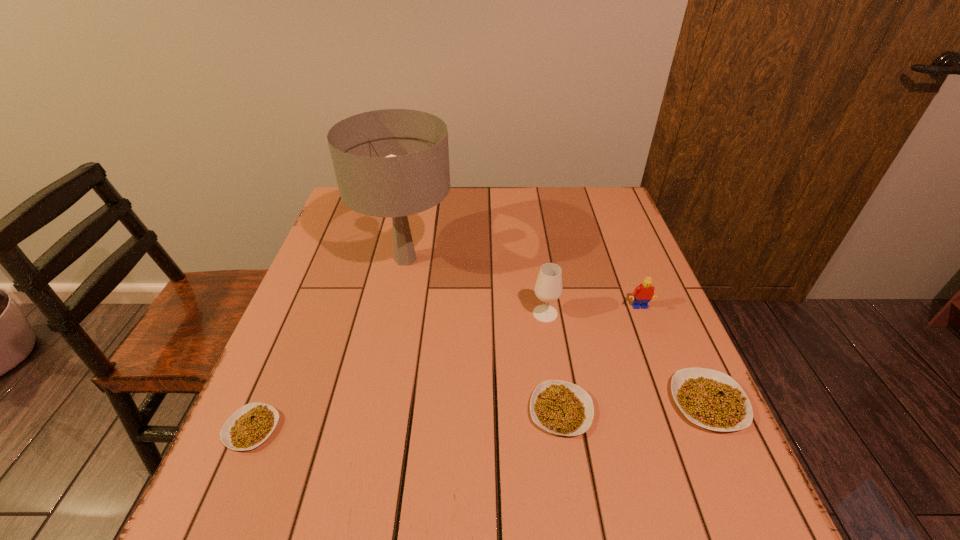
Identify which legume is the closest to the second tallest legume. Please provide its 2D coordinates. Your answer should be formatted as a tuple, i.e. [(x, y)], where the tuple contains the x and y coordinates of a point satisfying the conditions above.

[(711, 399)]

Find the location of a particular element. The height and width of the screenshot is (540, 960). legume that is the third closest to the lampshade is located at coordinates (711, 399).

Find the location of a particular element. The width and height of the screenshot is (960, 540). free space that satisfies the following two spatial constraints: 1. on the back side of the rightmost legume; 2. on the front-facing side of the tallest object is located at coordinates (644, 259).

I want to click on vacant point that satisfies the following two spatial constraints: 1. on the front-facing side of the second object from left to right; 2. on the back side of the fifth shortest object, so click(x=395, y=314).

Where is `free space that satisfies the following two spatial constraints: 1. on the front-facing side of the glass; 2. on the left side of the second object from left to right`? free space that satisfies the following two spatial constraints: 1. on the front-facing side of the glass; 2. on the left side of the second object from left to right is located at coordinates (395, 314).

Locate an element on the screen. This screenshot has width=960, height=540. free location that satisfies the following two spatial constraints: 1. on the front-facing side of the second object from left to right; 2. on the left side of the third shortest object is located at coordinates (377, 402).